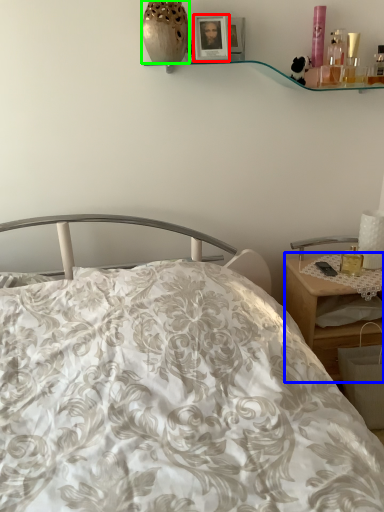
Question: Based on their relative distances, which object is nearer to picture frame (highlighted by a red box)? Choose from desk (highlighted by a blue box) and vase (highlighted by a green box).

Choices:
 (A) desk
 (B) vase

Answer: (B)